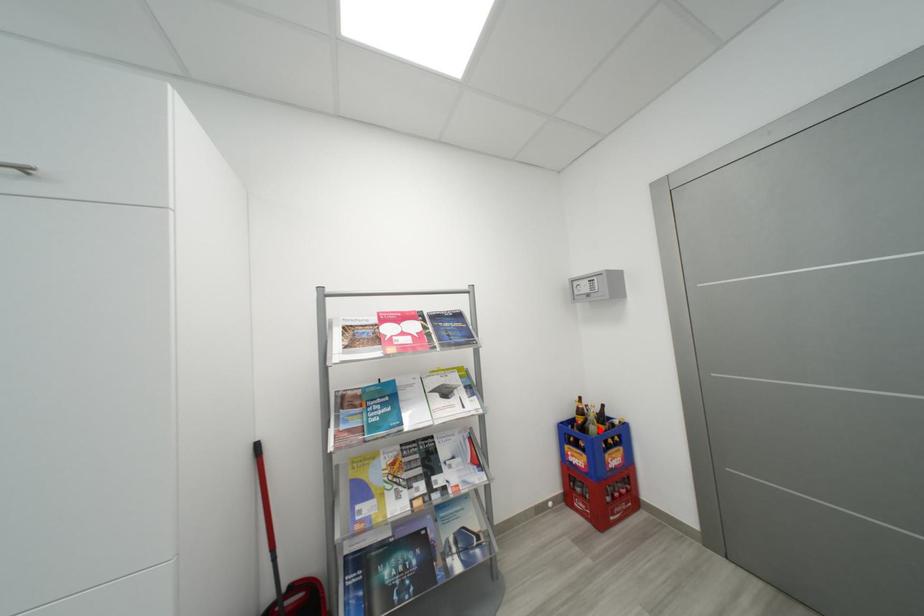
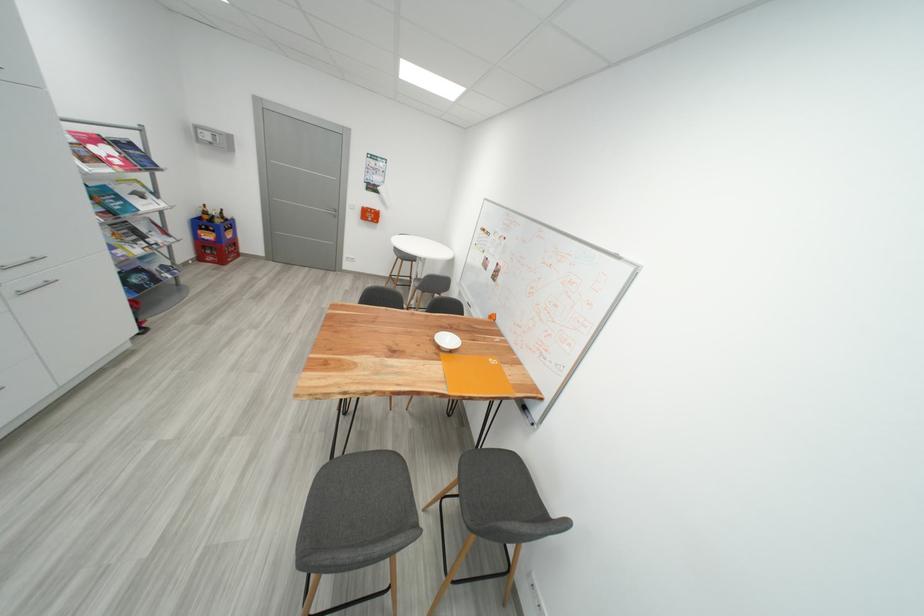
Where in the second image is the point corresponding to the highlighted location from the first image?

(225, 223)